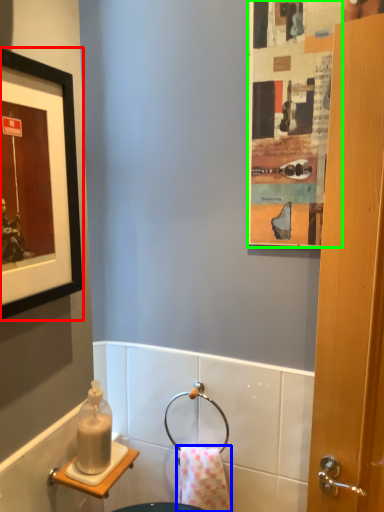
Question: Which object is positioned farthest from picture frame (highlighted by a red box)? Select from towel/napkin (highlighted by a blue box) and poster (highlighted by a green box).

Choices:
 (A) towel/napkin
 (B) poster

Answer: (A)